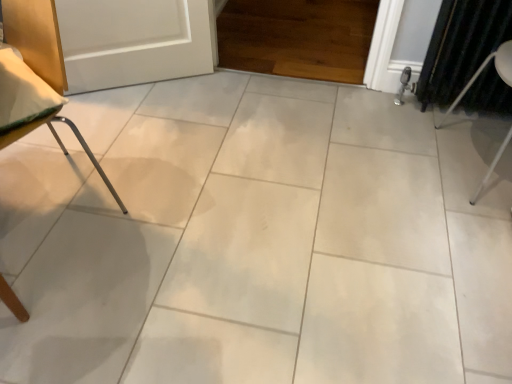
Question: From a real-world perspective, is metallic silver chair leg at left, positioned as the second furniture in right-to-left order, physically located above or below dark green fabric curtain at right?

Choices:
 (A) above
 (B) below

Answer: (A)

Question: Is metallic silver chair leg at left, marked as the 1th furniture in a left-to-right arrangement, spatially inside dark green fabric curtain at right, or outside of it?

Choices:
 (A) outside
 (B) inside

Answer: (A)

Question: Which of these objects is positioned closest to the metallic silver chair leg at left, marked as the 1th furniture in a left-to-right arrangement?

Choices:
 (A) dark green fabric curtain at right
 (B) white metal chair at right, the second furniture viewed from the left

Answer: (A)

Question: Which is nearer to the dark green fabric curtain at right?

Choices:
 (A) white metal chair at right, the second furniture viewed from the left
 (B) metallic silver chair leg at left, positioned as the second furniture in right-to-left order

Answer: (A)